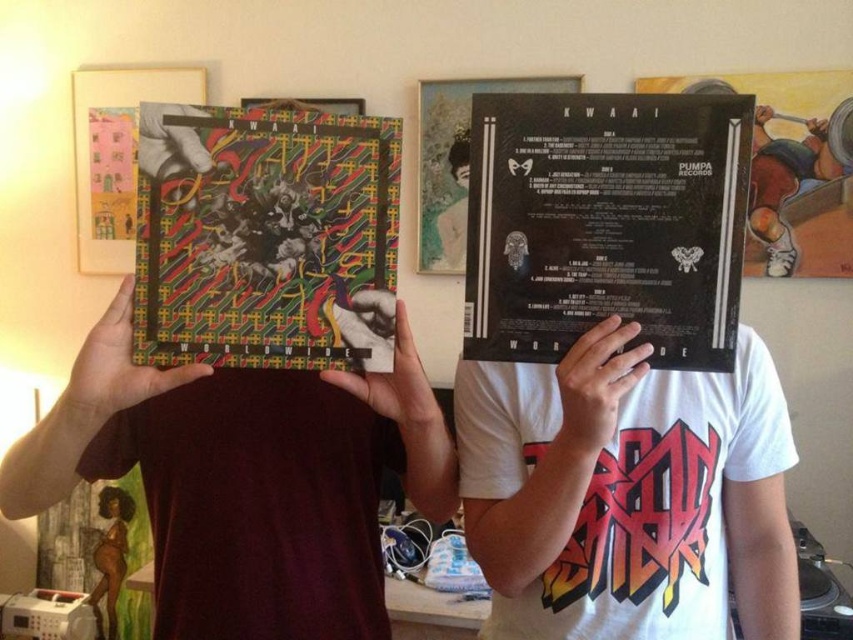
Who is higher up, smooth brown hair at center or matte black hair at center?

matte black hair at center is above.

Is the position of smooth brown hair at center less distant than that of matte black hair at center?

No.

Who is more distant from viewer, (x=112, y=500) or (x=459, y=138)?

The point (x=112, y=500) is more distant.

Image resolution: width=853 pixels, height=640 pixels. I want to click on smooth brown hair at center, so click(x=115, y=502).

Find the location of `multicolored paper art at center`. multicolored paper art at center is located at coordinates (264, 236).

Looking at this image, can you confirm if multicolored paper art at center is thinner than smooth brown hair at center?

No.

Between point (183, 260) and point (106, 490), which one is positioned in front?

Positioned in front is point (183, 260).

Where is `multicolored paper art at center`? The image size is (853, 640). multicolored paper art at center is located at coordinates (264, 236).

Between point (640, 193) and point (460, 160), which one is positioned in front?

Positioned in front is point (640, 193).

Is black matte vinyl record at center thinner than matte black hair at center?

In fact, black matte vinyl record at center might be wider than matte black hair at center.

Which is behind, point (689, 276) or point (457, 161)?

Point (457, 161)

Where is `black matte vinyl record at center`? black matte vinyl record at center is located at coordinates (606, 224).